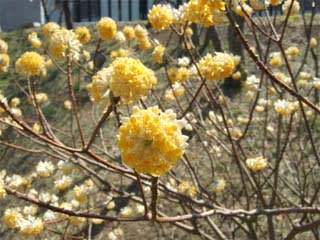
Locate an element on the screen. wall is located at coordinates (29, 12).